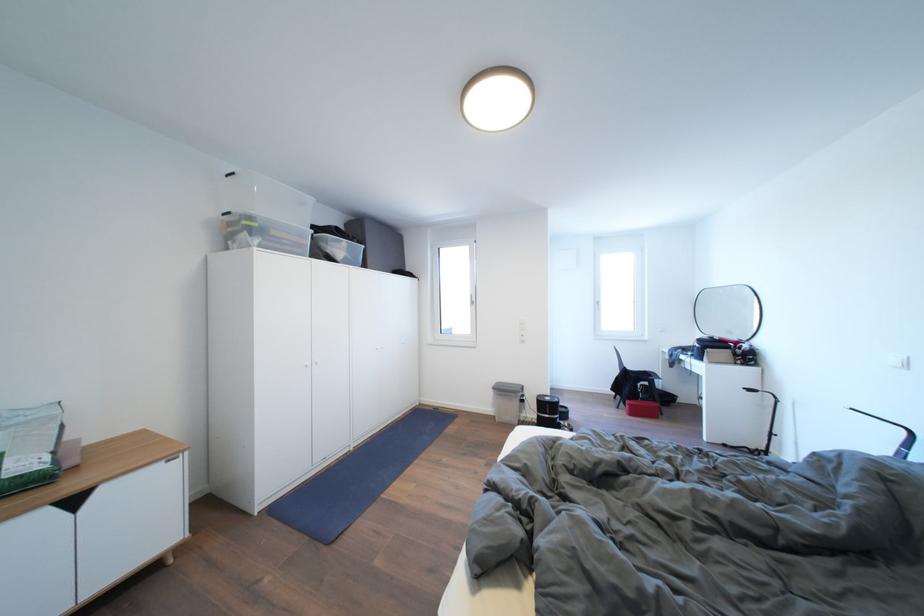
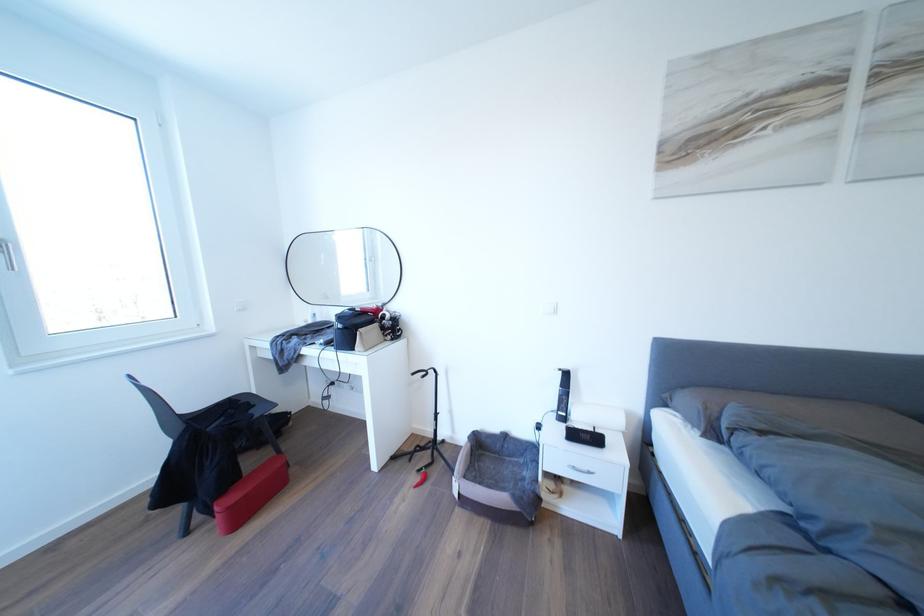
The point at [604,309] is marked in the first image. Where is the corresponding point in the second image?

(6, 254)